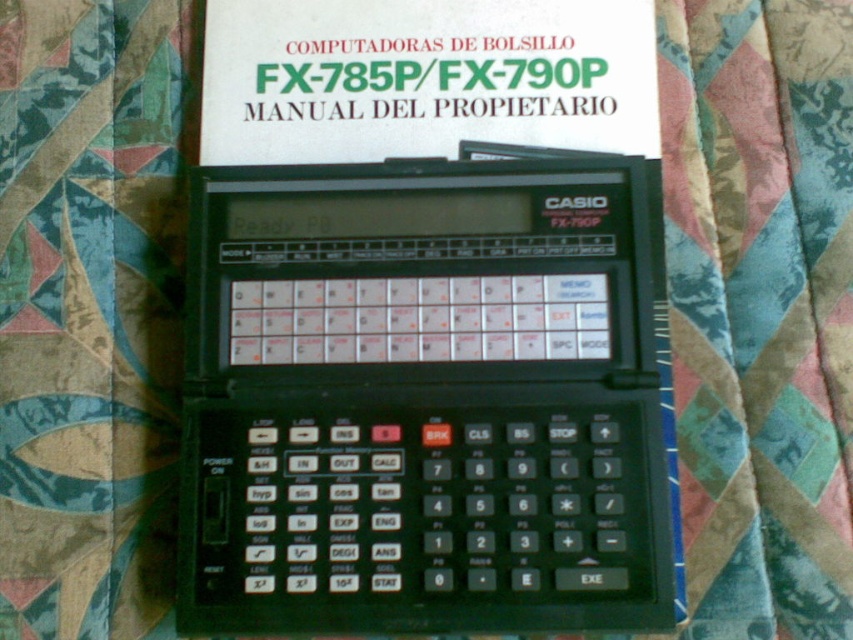
You are trying to place a small sticker on the calculator. The sticker is 0.05 units in size. Can you place it at point (427, 397) without overlapping any other objects?

Yes, you can place the sticker at point (427, 397) because the black plastic calculator at center is located exactly at that point, so the sticker will be placed on the calculator itself.

You are trying to determine if the black plastic calculator at center can be placed on top of the textured fabric at center without exceeding its edges. Based on their sizes, can the calculator fit entirely on the fabric?

The black plastic calculator at center is larger in size than textured fabric at center, so it cannot fit entirely on the fabric.

You are a student who needs to place a ruler between the black plastic calculator at center and the white paper manual at upper center. What is the minimum length of the ruler required to reach both objects?

The black plastic calculator at center and the white paper manual at upper center are 20.07 centimeters apart from each other, so the ruler must be at least 20.07 centimeters long to reach both objects.